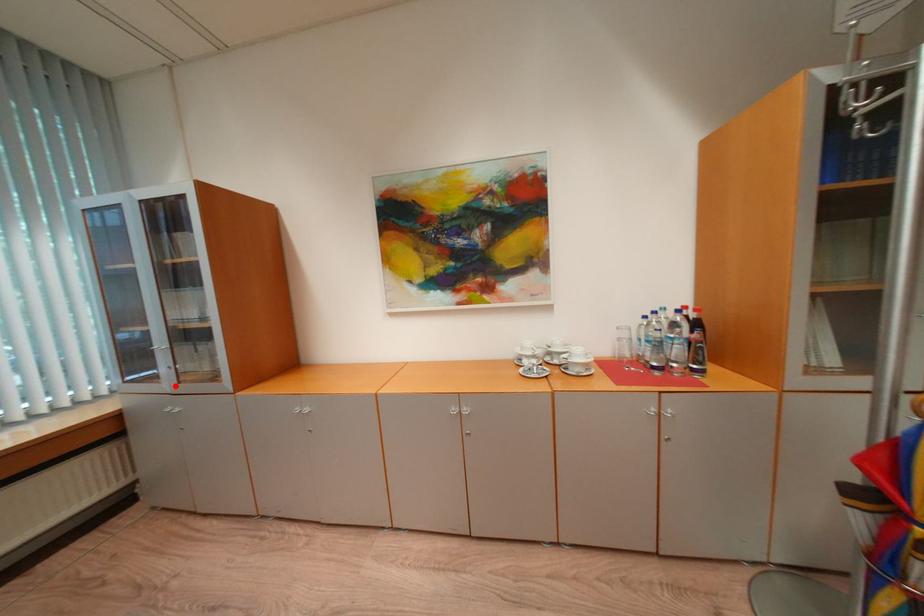
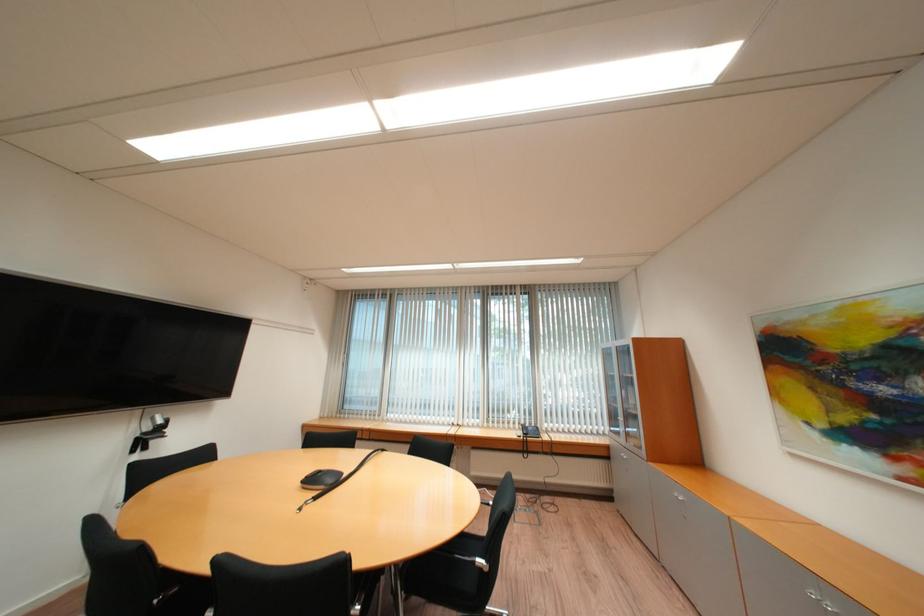
The point at the highlighted location is marked in the first image. Where is the corresponding point in the second image?

(630, 440)